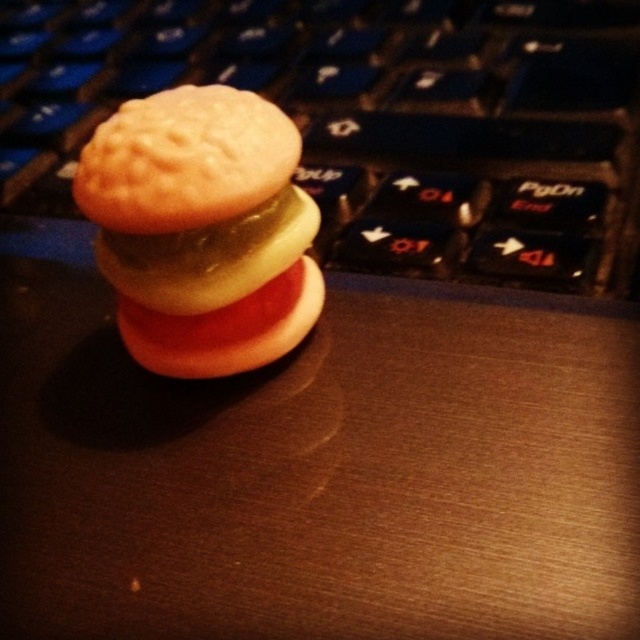
Question: Which is nearer to the matte plastic cookie at center?

Choices:
 (A) matte orange biscuit at center
 (B) black plastic keyboard at center

Answer: (A)

Question: Which point is farther to the camera?

Choices:
 (A) (92, 164)
 (B) (147, 8)

Answer: (B)

Question: Does black plastic keyboard at center have a larger size compared to matte orange biscuit at center?

Choices:
 (A) no
 (B) yes

Answer: (B)

Question: Is the position of black plastic keyboard at center less distant than that of matte plastic cookie at center?

Choices:
 (A) yes
 (B) no

Answer: (B)

Question: Can you confirm if black plastic keyboard at center is positioned above matte orange biscuit at center?

Choices:
 (A) no
 (B) yes

Answer: (B)

Question: Among these points, which one is nearest to the camera?

Choices:
 (A) (140, 106)
 (B) (216, 324)
 (C) (10, 1)

Answer: (A)